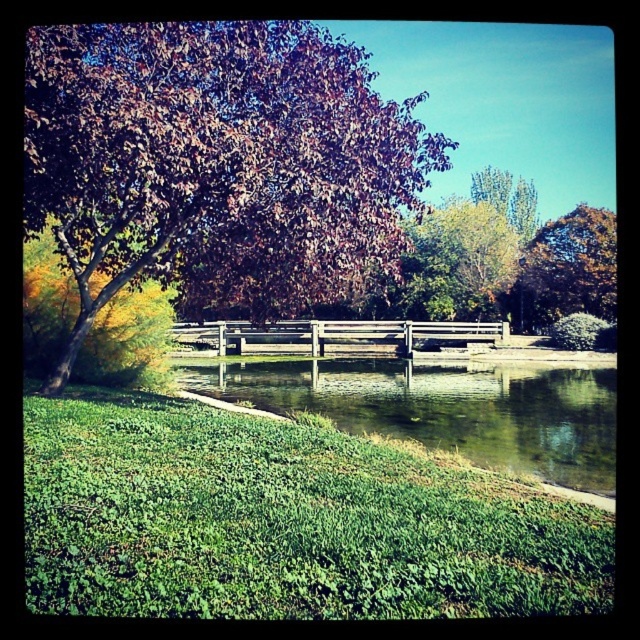
Question: Is green reflective water at center positioned at the back of wooden bench at center?

Choices:
 (A) yes
 (B) no

Answer: (B)

Question: Does shiny brown tree at upper left have a lesser width compared to green reflective water at center?

Choices:
 (A) yes
 (B) no

Answer: (A)

Question: Among these objects, which one is farthest from the camera?

Choices:
 (A) shiny brown tree at upper left
 (B) brown textured tree at upper right

Answer: (B)

Question: Is shiny brown tree at upper left thinner than wooden bench at center?

Choices:
 (A) yes
 (B) no

Answer: (A)

Question: Based on their relative distances, which object is farther from the wooden bench at center?

Choices:
 (A) green reflective water at center
 (B) shiny brown tree at upper left
 (C) brown textured tree at upper right

Answer: (C)

Question: Which object is the closest to the shiny brown tree at upper left?

Choices:
 (A) wooden bench at center
 (B) brown textured tree at upper right

Answer: (A)